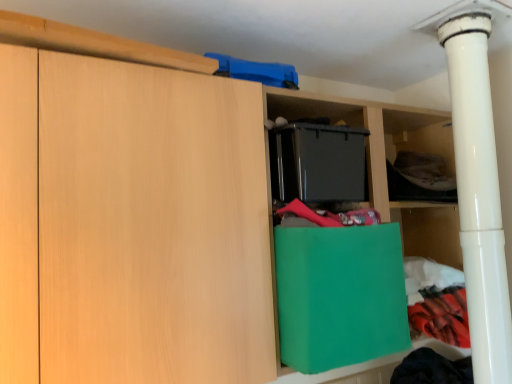
Where is `dark gray fabric at upper right`? The width and height of the screenshot is (512, 384). dark gray fabric at upper right is located at coordinates (421, 135).

Considering the sizes of objects green paper bag at center and dark gray fabric at upper right in the image provided, who is bigger, green paper bag at center or dark gray fabric at upper right?

Bigger between the two is green paper bag at center.

Is green paper bag at center positioned far away from dark gray fabric at upper right?

No, green paper bag at center is not far from dark gray fabric at upper right.

From the image's perspective, which is above, green paper bag at center or dark gray fabric at upper right?

dark gray fabric at upper right, from the image's perspective.

Between green paper bag at center and dark gray fabric at upper right, which one has less height?

Standing shorter between the two is dark gray fabric at upper right.

Is point (449, 135) farther from viewer compared to point (456, 107)?

Yes, point (449, 135) is farther from viewer.

From the image's perspective, does dark gray fabric at upper right appear higher than white glossy pipe at right?

Yes, from the image's perspective, dark gray fabric at upper right is on top of white glossy pipe at right.

Can we say dark gray fabric at upper right lies outside white glossy pipe at right?

Yes, dark gray fabric at upper right is outside of white glossy pipe at right.

Is green paper bag at center to the right of white glossy pipe at right from the viewer's perspective?

Incorrect, green paper bag at center is not on the right side of white glossy pipe at right.

Considering the relative sizes of green paper bag at center and white glossy pipe at right in the image provided, is green paper bag at center bigger than white glossy pipe at right?

Yes, green paper bag at center is bigger than white glossy pipe at right.

Which is closer, (384, 334) or (490, 368)?

Point (384, 334).

From the image's perspective, would you say green paper bag at center is positioned over white glossy pipe at right?

No, from the image's perspective, green paper bag at center is not above white glossy pipe at right.

Which is correct: dark gray fabric at upper right is inside green paper bag at center, or outside of it?

dark gray fabric at upper right is outside green paper bag at center.

How much distance is there between dark gray fabric at upper right and green paper bag at center?

The distance of dark gray fabric at upper right from green paper bag at center is 18.96 inches.

Which is in front, dark gray fabric at upper right or green paper bag at center?

green paper bag at center is in front.

Considering the relative positions of dark gray fabric at upper right and green paper bag at center in the image provided, is dark gray fabric at upper right to the right of green paper bag at center from the viewer's perspective?

Indeed, dark gray fabric at upper right is positioned on the right side of green paper bag at center.

Is there a large distance between white glossy pipe at right and green paper bag at center?

That's not correct — white glossy pipe at right is a little close to green paper bag at center.

From the picture: Between white glossy pipe at right and green paper bag at center, which one has larger size?

Bigger between the two is green paper bag at center.

What's the angular difference between white glossy pipe at right and green paper bag at center's facing directions?

1.56 degrees separate the facing orientations of white glossy pipe at right and green paper bag at center.

You are a GUI agent. You are given a task and a screenshot of the screen. Output one action in this format:
    pyautogui.click(x=<x>, y=<y>)
    Task: Click on the pillar above the green paper bag at center (from a real-world perspective)
    This screenshot has height=384, width=512.
    Given the screenshot: What is the action you would take?
    pyautogui.click(x=479, y=196)

Which is in front, point (479, 217) or point (402, 138)?

The point (479, 217) is closer.

Can you confirm if white glossy pipe at right is thinner than dark gray fabric at upper right?

In fact, white glossy pipe at right might be wider than dark gray fabric at upper right.

Is white glossy pipe at right oriented away from dark gray fabric at upper right?

That's right, white glossy pipe at right is facing away from dark gray fabric at upper right.

Is dark gray fabric at upper right located within white glossy pipe at right?

No, dark gray fabric at upper right is not a part of white glossy pipe at right.

Identify the location of cabinetry below the dark gray fabric at upper right (from a real-world perspective). (339, 295).

There is a white glossy pipe at right. Identify the location of shelf above it (from a real-world perspective). (421, 135).

Consider the image. Which object lies nearer to the anchor point dark gray fabric at upper right, green paper bag at center or white glossy pipe at right?

white glossy pipe at right is positioned closer to the anchor dark gray fabric at upper right.

From the image, which object appears to be farther from white glossy pipe at right, dark gray fabric at upper right or green paper bag at center?

green paper bag at center lies further to white glossy pipe at right than the other object.

Looking at the image, which one is located closer to green paper bag at center, white glossy pipe at right or dark gray fabric at upper right?

white glossy pipe at right is positioned closer to the anchor green paper bag at center.

Estimate the real-world distances between objects in this image. Which object is further from white glossy pipe at right, green paper bag at center or dark gray fabric at upper right?

green paper bag at center.

Based on their spatial positions, is white glossy pipe at right or green paper bag at center closer to dark gray fabric at upper right?

white glossy pipe at right.

Based on their spatial positions, is dark gray fabric at upper right or white glossy pipe at right closer to green paper bag at center?

Based on the image, white glossy pipe at right appears to be nearer to green paper bag at center.

Locate an element on the screen. shelf situated between green paper bag at center and white glossy pipe at right from left to right is located at coordinates (421, 135).